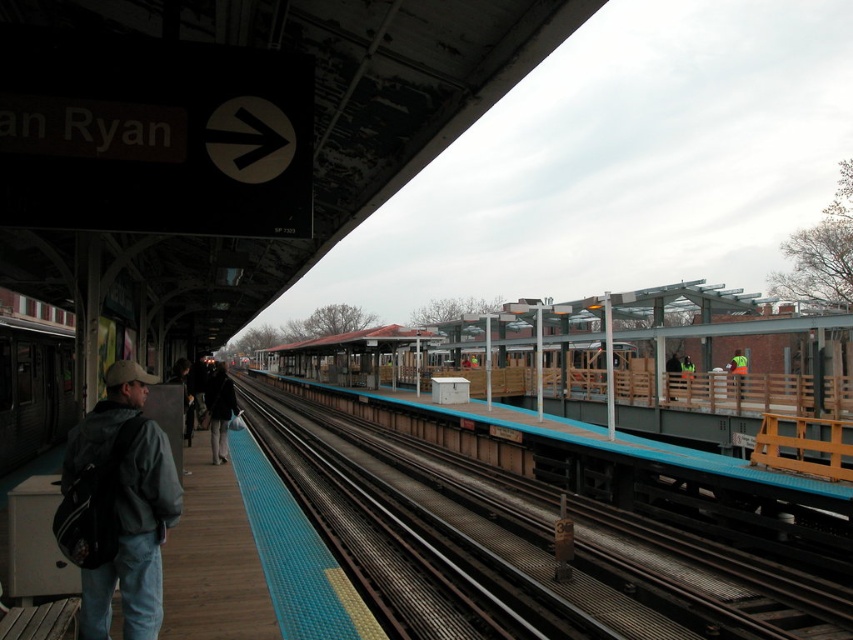
Question: Does wooden platform at left appear on the right side of dark gray jacket at center?

Choices:
 (A) no
 (B) yes

Answer: (B)

Question: Can you confirm if smooth concrete track at center is positioned to the left of gray fabric jacket at left?

Choices:
 (A) yes
 (B) no

Answer: (B)

Question: Which is farther from the gray fabric jacket at left?

Choices:
 (A) reflective yellow vest at center
 (B) smooth concrete track at center
 (C) dark gray jacket at center

Answer: (A)

Question: From the image, what is the correct spatial relationship of dark gray jacket at center in relation to reflective yellow vest at center?

Choices:
 (A) right
 (B) left

Answer: (B)

Question: Which is nearer to the dark gray jacket at center?

Choices:
 (A) reflective yellow vest at center
 (B) wooden platform at left
 (C) gray fabric jacket at left
 (D) smooth concrete track at center

Answer: (B)

Question: Which point is farther to the camera?

Choices:
 (A) (811, 593)
 (B) (334, 576)
 (C) (65, 528)

Answer: (A)